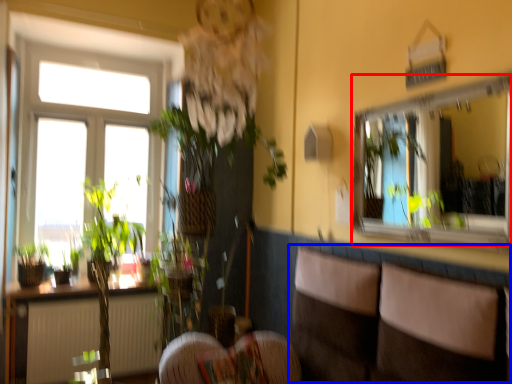
Question: Which of the following is the closest to the observer, mirror (highlighted by a red box) or couch (highlighted by a blue box)?

Choices:
 (A) mirror
 (B) couch

Answer: (B)